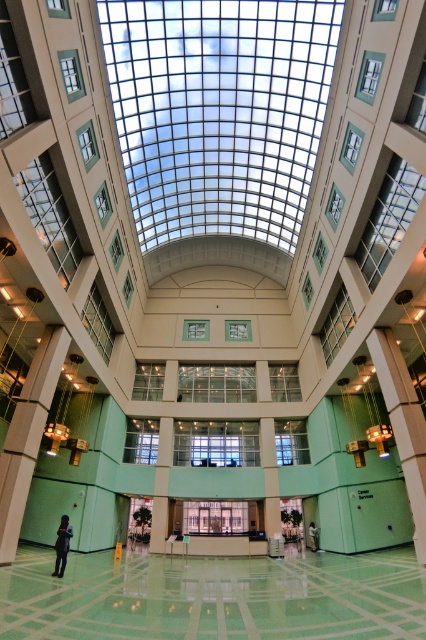
You are standing in the atrium and want to move from the point closer to the camera to the point further away. Which path should you take? The two points are labeled as point [51,604] and point [55,541]. Please describe the direction you need to move relative to the camera.

You should move towards the direction away from the camera. Since point [51,604] is closer to the camera than point [55,541], moving away from the camera will take you towards the farther point [55,541].

You are an architect designing a new atrium and want to ensure there is enough space between the green polished concrete floor at lower center and the light brown leather jacket at lower center for a 50 foot long sculpture. Can the space accommodate it?

The distance between the green polished concrete floor at lower center and the light brown leather jacket at lower center is 53.11 feet, which is sufficient to accommodate a 50 foot long sculpture.